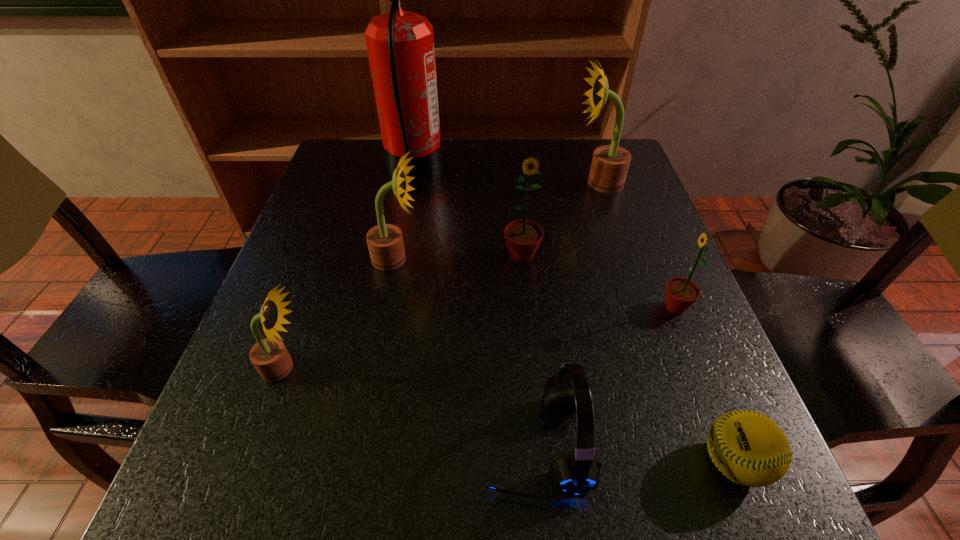
This screenshot has width=960, height=540. I want to click on sunflower that can be found as the closest to the seventh shortest object, so click(x=523, y=237).

Point out which yellow sunflower is positioned as the second nearest to the tallest sunflower. Please provide its 2D coordinates. Your answer should be formatted as a tuple, i.e. [(x, y)], where the tuple contains the x and y coordinates of a point satisfying the conditions above.

[(269, 356)]

The width and height of the screenshot is (960, 540). In order to click on yellow sunflower that is the third closest to the bigger green sunflower in this screenshot , I will do `click(269, 356)`.

In order to click on free location that satisfies the following two spatial constraints: 1. on the face of the third sunflower from right to left; 2. on the face of the leftmost object in this screenshot , I will do `click(532, 368)`.

This screenshot has height=540, width=960. I want to click on free space that satisfies the following two spatial constraints: 1. on the face of the third sunflower from right to left; 2. on the face of the second biggest yellow sunflower, so click(522, 259).